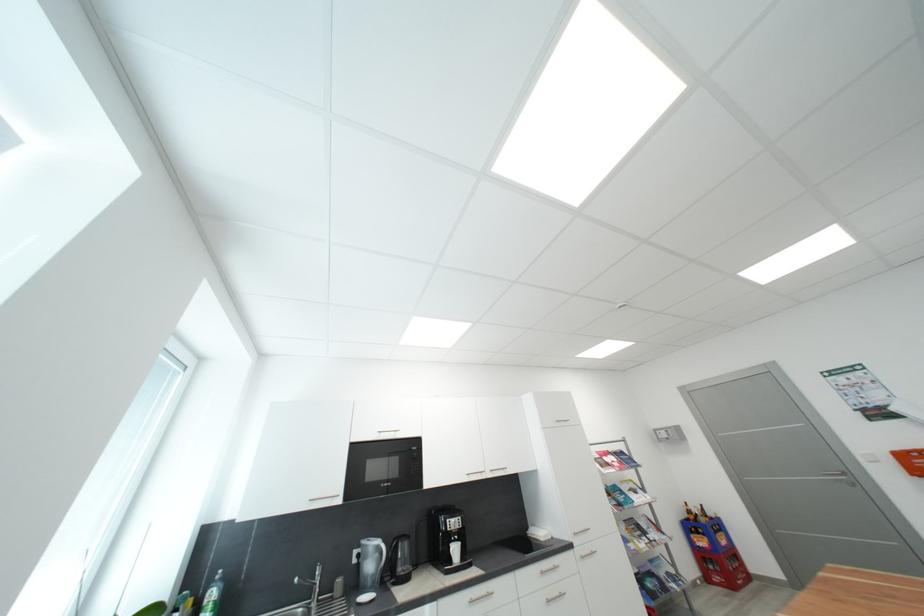
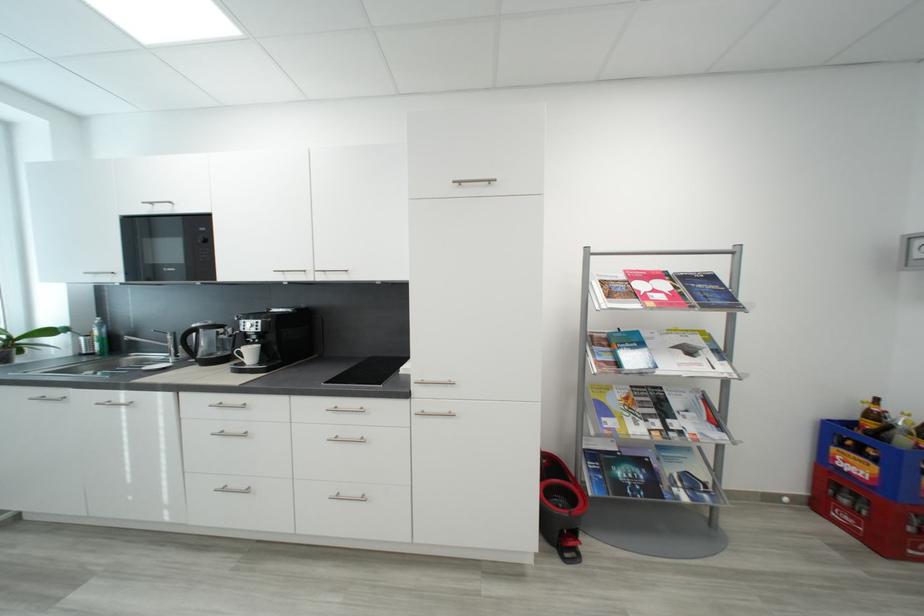
Where in the second image is the point corresponding to the point at 704,533 from the first image?

(867, 454)